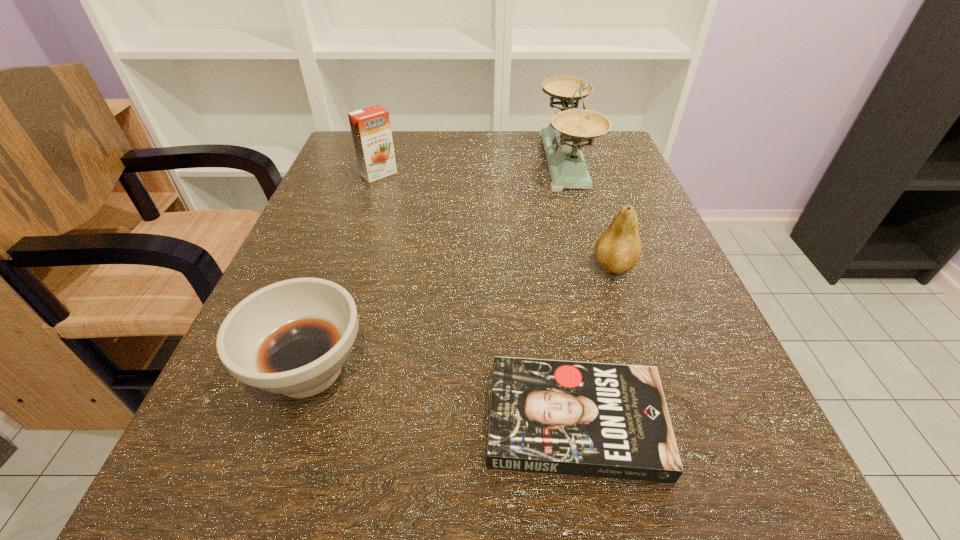
The image size is (960, 540). I want to click on vacant space positioned 0.180m on the right of the fourth tallest object, so click(509, 369).

The image size is (960, 540). What are the coordinates of `vacant space situated 0.050m on the front of the book` in the screenshot? It's located at (595, 536).

Image resolution: width=960 pixels, height=540 pixels. What are the coordinates of `scale that is at the far edge` in the screenshot? It's located at (562, 139).

Where is `orange juice positioned at the far edge`? orange juice positioned at the far edge is located at coordinates (371, 130).

This screenshot has width=960, height=540. What are the coordinates of `object that is at the near edge` in the screenshot? It's located at (605, 420).

You are a GUI agent. You are given a task and a screenshot of the screen. Output one action in this format:
    pyautogui.click(x=<x>, y=<y>)
    Task: Click on the orange juice at the left edge
    The height and width of the screenshot is (540, 960).
    Given the screenshot: What is the action you would take?
    pyautogui.click(x=371, y=130)

You are a GUI agent. You are given a task and a screenshot of the screen. Output one action in this format:
    pyautogui.click(x=<x>, y=<y>)
    Task: Click on the soup bowl present at the left edge
    This screenshot has width=960, height=540.
    Given the screenshot: What is the action you would take?
    pyautogui.click(x=292, y=337)

Locate an element on the screen. scale present at the right edge is located at coordinates click(x=562, y=139).

You are a GUI agent. You are given a task and a screenshot of the screen. Output one action in this format:
    pyautogui.click(x=<x>, y=<y>)
    Task: Click on the pear that is at the right edge
    This screenshot has height=540, width=960.
    Given the screenshot: What is the action you would take?
    pyautogui.click(x=618, y=248)

At what (x,y) coordinates should I click in order to perform the action: click on book that is at the right edge. Please return your answer as a coordinate pair (x, y). The width and height of the screenshot is (960, 540). Looking at the image, I should click on (605, 420).